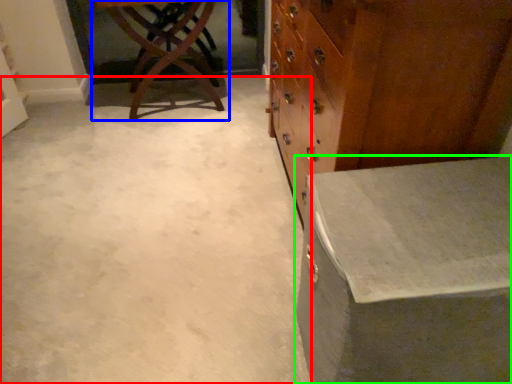
Question: Which object is positioned farthest from concrete (highlighted by a red box)? Select from table (highlighted by a blue box) and table (highlighted by a green box).

Choices:
 (A) table
 (B) table

Answer: (A)